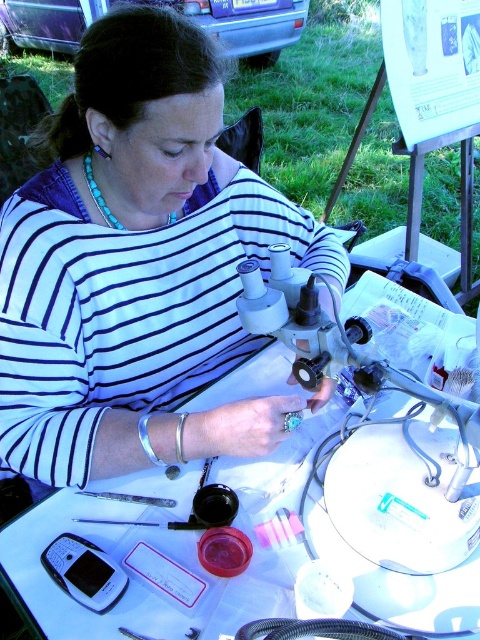
Question: Which point is closer to the camera?

Choices:
 (A) (468, 614)
 (B) (275, 412)

Answer: (A)

Question: Among these objects, which one is farthest from the camera?

Choices:
 (A) white striped shirt at center
 (B) white plastic table at center

Answer: (A)

Question: Observing the image, what is the correct spatial positioning of white striped shirt at center in reference to white plastic table at center?

Choices:
 (A) above
 (B) below

Answer: (A)

Question: Is white striped shirt at center smaller than white plastic table at center?

Choices:
 (A) yes
 (B) no

Answer: (B)

Question: Can you confirm if white striped shirt at center is positioned to the left of white plastic table at center?

Choices:
 (A) yes
 (B) no

Answer: (A)